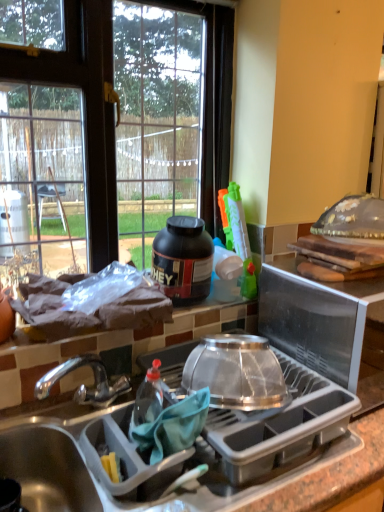
Question: Can you confirm if matte gray sink at lower left is shorter than gray plastic dish rack at center?

Choices:
 (A) no
 (B) yes

Answer: (B)

Question: From a real-world perspective, is matte gray sink at lower left beneath gray plastic dish rack at center?

Choices:
 (A) no
 (B) yes

Answer: (A)

Question: Is gray plastic dish rack at center at the back of matte gray sink at lower left?

Choices:
 (A) yes
 (B) no

Answer: (B)

Question: Considering the relative sizes of matte gray sink at lower left and gray plastic dish rack at center in the image provided, is matte gray sink at lower left bigger than gray plastic dish rack at center?

Choices:
 (A) no
 (B) yes

Answer: (A)

Question: Does matte gray sink at lower left appear on the left side of gray plastic dish rack at center?

Choices:
 (A) yes
 (B) no

Answer: (A)

Question: Relative to black matte protein jar at upper center, the first kitchen appliance when ordered from top to bottom, is gray plastic dish rack at center in front or behind?

Choices:
 (A) front
 (B) behind

Answer: (A)

Question: Based on their positions, is gray plastic dish rack at center located to the left or right of black matte protein jar at upper center, placed as the 2th kitchen appliance when sorted from bottom to top?

Choices:
 (A) right
 (B) left

Answer: (B)

Question: From a real-world perspective, relative to black matte protein jar at upper center, arranged as the 1th kitchen appliance when viewed from the back, is gray plastic dish rack at center vertically above or below?

Choices:
 (A) above
 (B) below

Answer: (B)

Question: Looking at their shapes, would you say gray plastic dish rack at center is wider or thinner than black matte protein jar at upper center, the first kitchen appliance when ordered from top to bottom?

Choices:
 (A) wide
 (B) thin

Answer: (A)

Question: From the image's perspective, relative to transparent plastic lid at upper right, the 2th appliance from the left, is gray plastic dish rack at center above or below?

Choices:
 (A) below
 (B) above

Answer: (A)

Question: In the image, is gray plastic dish rack at center on the left side or the right side of transparent plastic lid at upper right, the 2th appliance from the left?

Choices:
 (A) right
 (B) left

Answer: (B)

Question: Does point (355, 315) appear closer or farther from the camera than point (329, 287)?

Choices:
 (A) farther
 (B) closer

Answer: (B)

Question: Based on their sizes in the image, would you say gray plastic dish rack at center is bigger or smaller than transparent plastic lid at upper right, the 2th appliance from the left?

Choices:
 (A) big
 (B) small

Answer: (B)

Question: Is transparent glass window at upper left inside the boundaries of matte gray sink at lower left, or outside?

Choices:
 (A) inside
 (B) outside

Answer: (B)

Question: In terms of width, does transparent glass window at upper left look wider or thinner when compared to matte gray sink at lower left?

Choices:
 (A) thin
 (B) wide

Answer: (A)